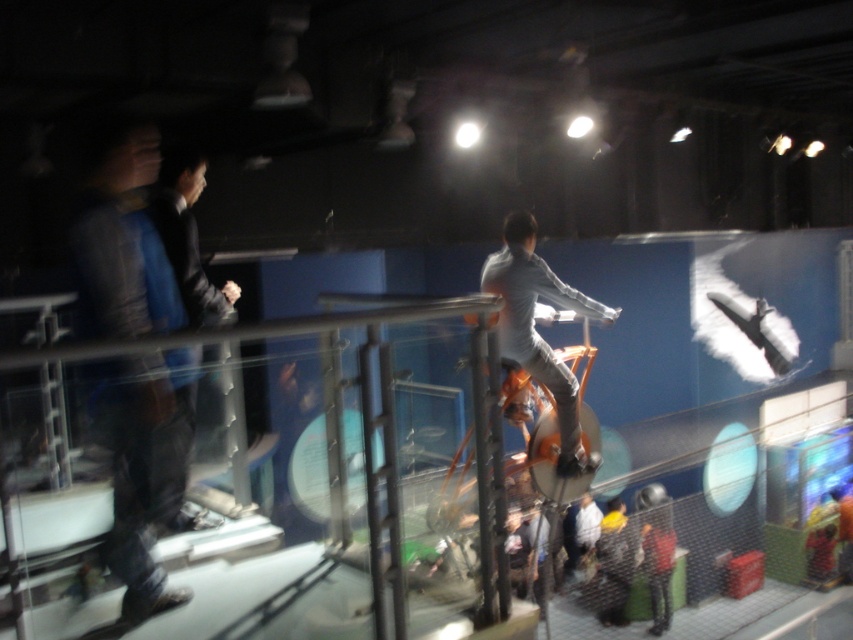
Question: Can you confirm if light gray fabric shirt at center is smaller than red fabric jacket at lower right?

Choices:
 (A) no
 (B) yes

Answer: (A)

Question: Is light gray fabric shirt at center positioned in front of dark blue suit at left?

Choices:
 (A) no
 (B) yes

Answer: (A)

Question: Which point is farther to the camera?

Choices:
 (A) light gray fabric shirt at center
 (B) dark blue suit at left

Answer: (A)

Question: Can you confirm if blue denim jeans at left is positioned to the right of red fabric jacket at lower right?

Choices:
 (A) no
 (B) yes

Answer: (A)

Question: Which point is farther to the camera?

Choices:
 (A) (239, 289)
 (B) (543, 340)
 (C) (659, 577)
 (D) (129, 412)

Answer: (C)

Question: Which of the following is the closest to the observer?

Choices:
 (A) light gray fabric shirt at center
 (B) red fabric jacket at lower right
 (C) dark blue suit at left
 (D) blue denim jeans at left

Answer: (D)